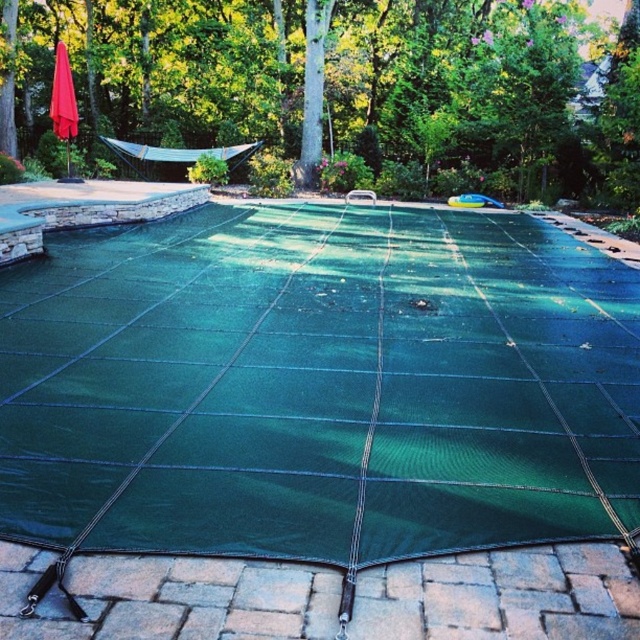
Question: Which object is positioned closest to the red fabric umbrella at upper left?

Choices:
 (A) green mesh netting at center
 (B) green mesh net at center

Answer: (B)

Question: Based on their relative distances, which object is nearer to the green mesh netting at center?

Choices:
 (A) green mesh net at center
 (B) red fabric umbrella at upper left

Answer: (B)

Question: Considering the relative positions of green mesh netting at center and red fabric umbrella at upper left in the image provided, where is green mesh netting at center located with respect to red fabric umbrella at upper left?

Choices:
 (A) left
 (B) right

Answer: (B)

Question: Can you confirm if green mesh netting at center is thinner than red fabric umbrella at upper left?

Choices:
 (A) no
 (B) yes

Answer: (A)

Question: Among these points, which one is nearest to the camera?

Choices:
 (A) (358, 115)
 (B) (61, 54)

Answer: (B)

Question: Is green mesh net at center smaller than red fabric umbrella at upper left?

Choices:
 (A) yes
 (B) no

Answer: (B)